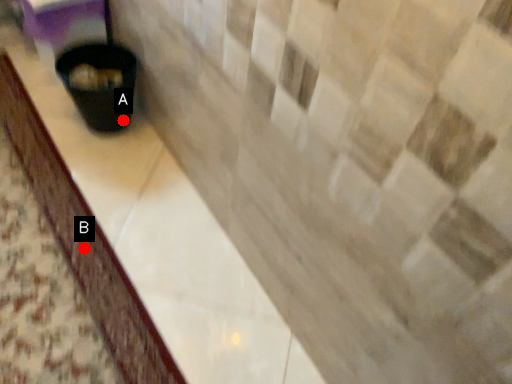
Question: Two points are circled on the image, labeled by A and B beside each circle. Which point is closer to the camera?

Choices:
 (A) A is closer
 (B) B is closer

Answer: (B)